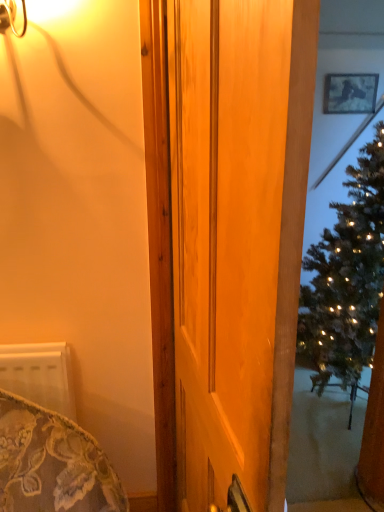
This screenshot has width=384, height=512. I want to click on wooden door at center, so click(225, 237).

What do you see at coordinates (225, 237) in the screenshot? The image size is (384, 512). I see `wooden door at center` at bounding box center [225, 237].

What are the coordinates of `metallic silver picture frame at upper right` in the screenshot? It's located at (350, 93).

The image size is (384, 512). What do you see at coordinates (350, 93) in the screenshot? I see `metallic silver picture frame at upper right` at bounding box center [350, 93].

Image resolution: width=384 pixels, height=512 pixels. I want to click on wooden door at center, so click(x=225, y=237).

Considering the positions of objects wooden door at center and metallic silver picture frame at upper right in the image provided, who is more to the right, wooden door at center or metallic silver picture frame at upper right?

From the viewer's perspective, metallic silver picture frame at upper right appears more on the right side.

Between wooden door at center and metallic silver picture frame at upper right, which one is positioned behind?

Positioned behind is metallic silver picture frame at upper right.

Is point (176, 78) less distant than point (370, 111)?

Yes, it is in front of point (370, 111).

From the image's perspective, is wooden door at center on top of metallic silver picture frame at upper right?

No, from the image's perspective, wooden door at center is not above metallic silver picture frame at upper right.

From a real-world perspective, which is physically above, wooden door at center or metallic silver picture frame at upper right?

metallic silver picture frame at upper right, from a real-world perspective.

Between wooden door at center and metallic silver picture frame at upper right, which one has larger width?

wooden door at center is wider.

Considering the relative sizes of wooden door at center and metallic silver picture frame at upper right in the image provided, is wooden door at center taller than metallic silver picture frame at upper right?

Yes, wooden door at center is taller than metallic silver picture frame at upper right.

Which of these two, wooden door at center or metallic silver picture frame at upper right, is smaller?

Smaller between the two is metallic silver picture frame at upper right.

Is wooden door at center inside the boundaries of metallic silver picture frame at upper right, or outside?

wooden door at center is located beyond the bounds of metallic silver picture frame at upper right.

Would you say wooden door at center is a long distance from metallic silver picture frame at upper right?

wooden door at center is far away from metallic silver picture frame at upper right.

Does wooden door at center turn towards metallic silver picture frame at upper right?

No.

How far apart are wooden door at center and metallic silver picture frame at upper right?

wooden door at center is 1.73 meters away from metallic silver picture frame at upper right.

This screenshot has height=512, width=384. I want to click on door in front of the metallic silver picture frame at upper right, so click(225, 237).

Which object is positioned more to the left, metallic silver picture frame at upper right or wooden door at center?

wooden door at center.

Which object is closer to the camera, metallic silver picture frame at upper right or wooden door at center?

wooden door at center is closer to the camera.

Between point (374, 99) and point (193, 121), which one is positioned in front?

The point (193, 121) is in front.

From the image's perspective, who appears lower, metallic silver picture frame at upper right or wooden door at center?

wooden door at center is shown below in the image.

From a real-world perspective, is metallic silver picture frame at upper right positioned over wooden door at center based on gravity?

Indeed, from a real-world perspective, metallic silver picture frame at upper right stands above wooden door at center.

From the picture: Which of these two, metallic silver picture frame at upper right or wooden door at center, is thinner?

metallic silver picture frame at upper right is thinner.

Who is shorter, metallic silver picture frame at upper right or wooden door at center?

metallic silver picture frame at upper right is shorter.

Is metallic silver picture frame at upper right smaller than wooden door at center?

Yes.

Is metallic silver picture frame at upper right outside of wooden door at center?

metallic silver picture frame at upper right lies outside wooden door at center's area.

Does metallic silver picture frame at upper right touch wooden door at center?

No, metallic silver picture frame at upper right is not in contact with wooden door at center.

Is wooden door at center at the back of metallic silver picture frame at upper right?

metallic silver picture frame at upper right is not turned away from wooden door at center.

How different are the orientations of metallic silver picture frame at upper right and wooden door at center in degrees?

They differ by 0.798 degrees in their facing directions.

You are a GUI agent. You are given a task and a screenshot of the screen. Output one action in this format:
    pyautogui.click(x=<x>, y=<y>)
    Task: Click on the door on the left of metallic silver picture frame at upper right
    The image size is (384, 512).
    Given the screenshot: What is the action you would take?
    pyautogui.click(x=225, y=237)

Find the location of a particular element. Image resolution: width=384 pixels, height=512 pixels. picture frame lying on the right of wooden door at center is located at coordinates [350, 93].

You are a GUI agent. You are given a task and a screenshot of the screen. Output one action in this format:
    pyautogui.click(x=<x>, y=<y>)
    Task: Click on the picture frame above the wooden door at center (from the image's perspective)
    
    Given the screenshot: What is the action you would take?
    pyautogui.click(x=350, y=93)